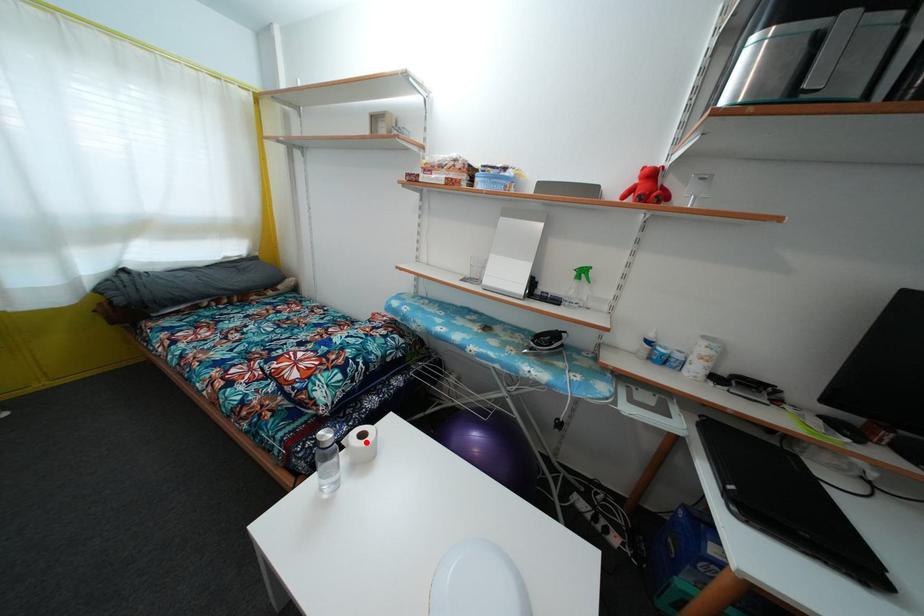
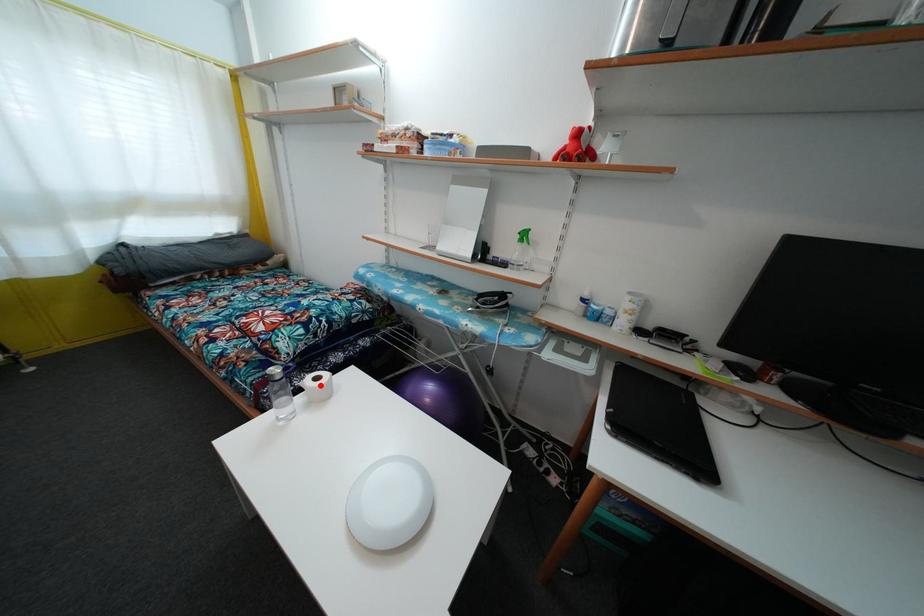
I am providing you with two images of the same scene from different viewpoints. A red point is marked on the first image and another point is marked on the second image. Do the highlighted points in image1 and image2 indicate the same real-world spot?

Yes